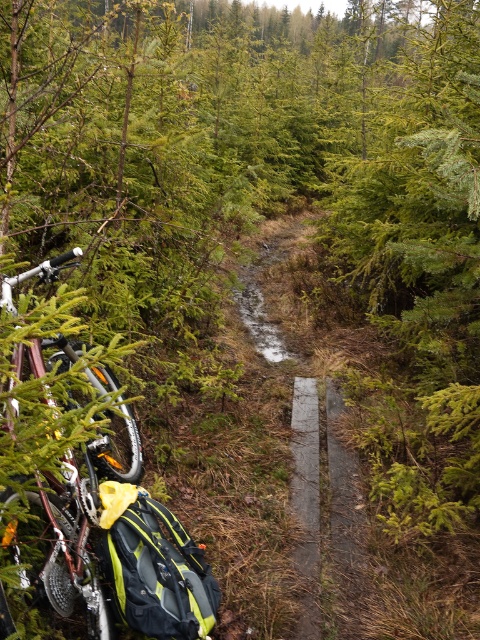
Does silver metallic bicycle at left appear over smooth concrete path at center?

Correct, silver metallic bicycle at left is located above smooth concrete path at center.

Is the position of silver metallic bicycle at left less distant than that of smooth concrete path at center?

Yes, silver metallic bicycle at left is in front of smooth concrete path at center.

At what (x,y) coordinates should I click in order to perform the action: click on silver metallic bicycle at left. Please return your answer as a coordinate pair (x, y). This screenshot has width=480, height=640. Looking at the image, I should click on (108, 520).

Find the location of `silver metallic bicycle at left`. silver metallic bicycle at left is located at coordinates (108, 520).

Is brown wooden plank at center positioned in front of smooth concrete path at center?

No, brown wooden plank at center is further to the viewer.

Between brown wooden plank at center and smooth concrete path at center, which one has less height?

brown wooden plank at center is shorter.

Between point (265, 340) and point (300, 468), which one is positioned behind?

The point (265, 340) is behind.

The width and height of the screenshot is (480, 640). I want to click on brown wooden plank at center, so click(324, 500).

Can you confirm if silver metallic bicycle at left is positioned above brown wooden plank at center?

No, silver metallic bicycle at left is not above brown wooden plank at center.

Who is lower down, silver metallic bicycle at left or brown wooden plank at center?

silver metallic bicycle at left is below.

Identify the location of silver metallic bicycle at left. The width and height of the screenshot is (480, 640). (108, 520).